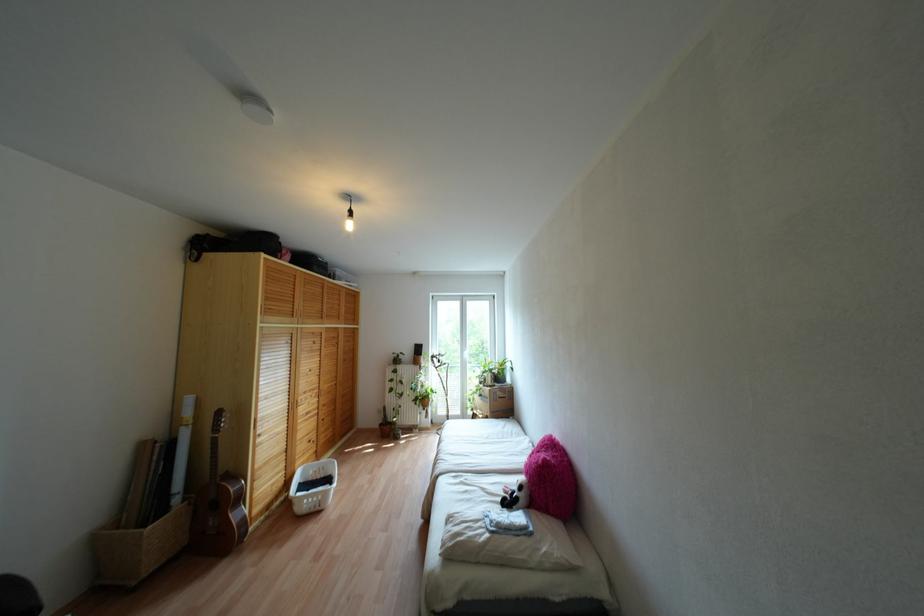
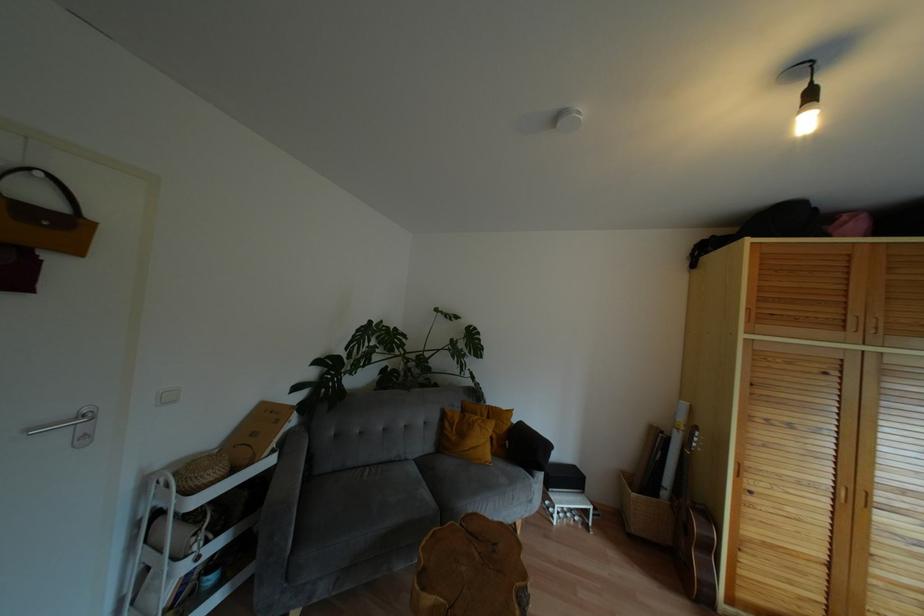
Question: The images are taken continuously from a first-person perspective. In which direction is your viewpoint rotating?

Choices:
 (A) Left
 (B) Right
 (C) Up
 (D) Down

Answer: (A)